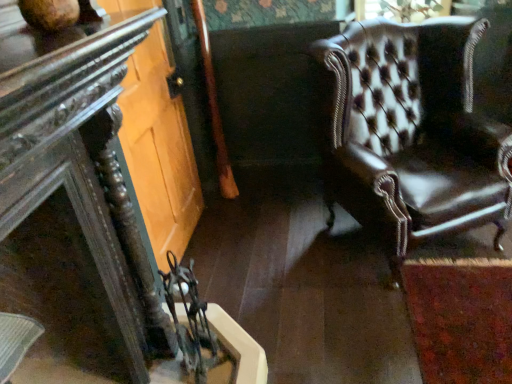
I want to click on vacant area that is in front of clear glass door at lower left, so click(x=242, y=296).